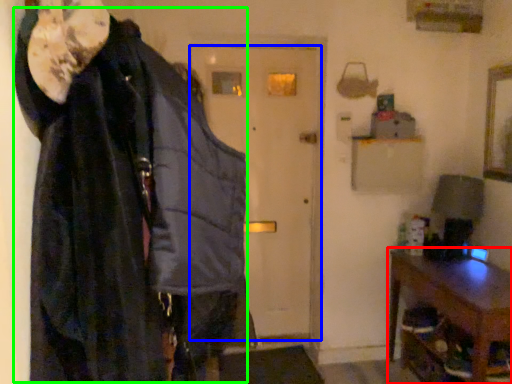
Question: Based on their relative distances, which object is farther from furniture (highlighted by a red box)? Choose from door (highlighted by a blue box) and cloak (highlighted by a green box).

Choices:
 (A) door
 (B) cloak

Answer: (B)